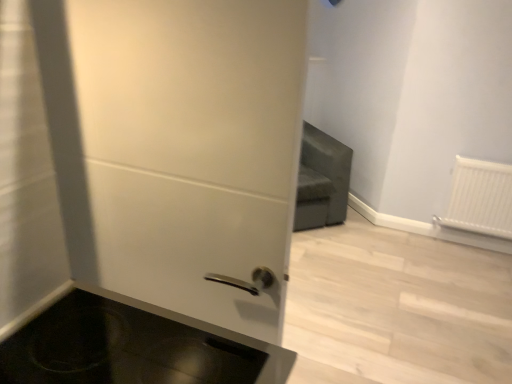
Question: Considering the relative positions of black glass cooktop at lower left and white matte door at center in the image provided, is black glass cooktop at lower left to the right of white matte door at center from the viewer's perspective?

Choices:
 (A) no
 (B) yes

Answer: (B)

Question: Does black glass cooktop at lower left lie in front of white matte door at center?

Choices:
 (A) yes
 (B) no

Answer: (A)

Question: From the image's perspective, is black glass cooktop at lower left located beneath white matte door at center?

Choices:
 (A) no
 (B) yes

Answer: (B)

Question: From the image's perspective, does black glass cooktop at lower left appear higher than white matte door at center?

Choices:
 (A) yes
 (B) no

Answer: (B)

Question: Is black glass cooktop at lower left bigger than white matte door at center?

Choices:
 (A) yes
 (B) no

Answer: (B)

Question: From the image's perspective, is black glass cooktop at lower left above or below white plastic radiator at right?

Choices:
 (A) above
 (B) below

Answer: (B)

Question: Is black glass cooktop at lower left in front of or behind white plastic radiator at right in the image?

Choices:
 (A) front
 (B) behind

Answer: (A)

Question: In the image, is black glass cooktop at lower left on the left side or the right side of white plastic radiator at right?

Choices:
 (A) right
 (B) left

Answer: (B)

Question: From a real-world perspective, is black glass cooktop at lower left positioned above or below white plastic radiator at right?

Choices:
 (A) below
 (B) above

Answer: (B)

Question: From a real-world perspective, is black glass cooktop at lower left above or below white matte door at center?

Choices:
 (A) below
 (B) above

Answer: (A)

Question: In terms of height, does black glass cooktop at lower left look taller or shorter compared to white matte door at center?

Choices:
 (A) short
 (B) tall

Answer: (A)

Question: Choose the correct answer: Is black glass cooktop at lower left inside white matte door at center or outside it?

Choices:
 (A) outside
 (B) inside

Answer: (A)

Question: Is black glass cooktop at lower left to the left or to the right of white matte door at center in the image?

Choices:
 (A) left
 (B) right

Answer: (B)

Question: From the image's perspective, is white matte door at center positioned above or below black glass cooktop at lower left?

Choices:
 (A) above
 (B) below

Answer: (A)

Question: From their relative heights in the image, would you say white matte door at center is taller or shorter than black glass cooktop at lower left?

Choices:
 (A) tall
 (B) short

Answer: (A)